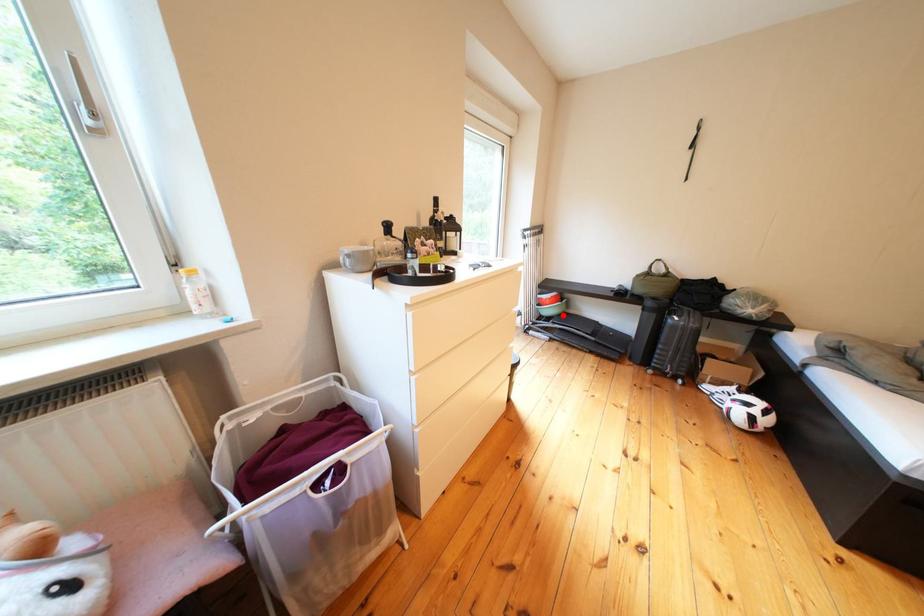
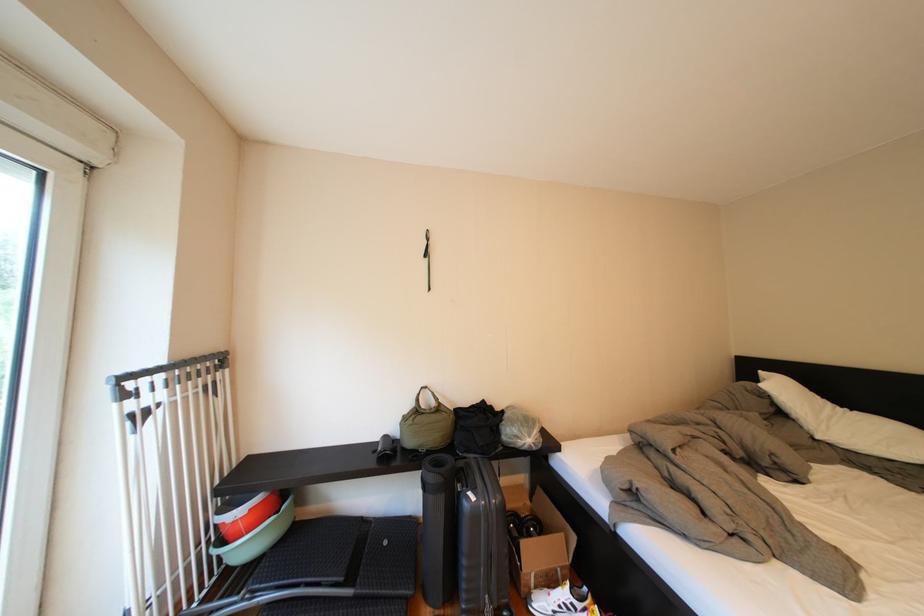
Locate, in the second image, the point that corresponds to the highlighted location in the first image.

(261, 551)